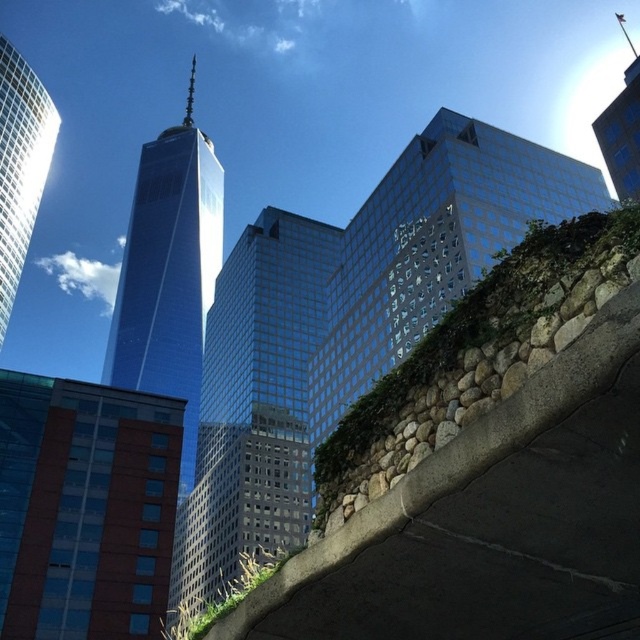
Question: Which of these objects is positioned closest to the shiny glass skyscraper at upper left?

Choices:
 (A) brown brick building at lower left
 (B) glassy reflective skyscraper at center
 (C) glassy blue skyscraper at center

Answer: (C)

Question: Based on their relative distances, which object is nearer to the shiny glass skyscraper at center?

Choices:
 (A) glassy blue skyscraper at center
 (B) shiny glass skyscraper at upper left

Answer: (A)

Question: Is stone concrete overpass at center smaller than glassy reflective skyscraper at center?

Choices:
 (A) yes
 (B) no

Answer: (A)

Question: Observing the image, what is the correct spatial positioning of stone concrete overpass at center in reference to glassy reflective skyscraper at center?

Choices:
 (A) right
 (B) left

Answer: (B)

Question: In this image, where is stone concrete overpass at center located relative to shiny glass skyscraper at center?

Choices:
 (A) above
 (B) below

Answer: (B)

Question: Based on their relative distances, which object is farther from the shiny glass skyscraper at upper left?

Choices:
 (A) stone concrete overpass at center
 (B) brown brick building at lower left
 (C) shiny glass skyscraper at center

Answer: (A)